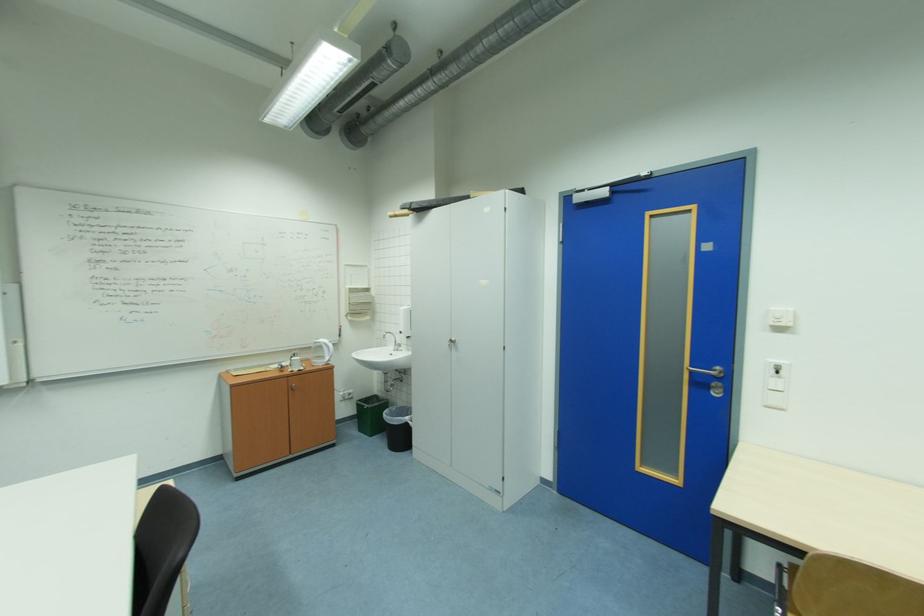
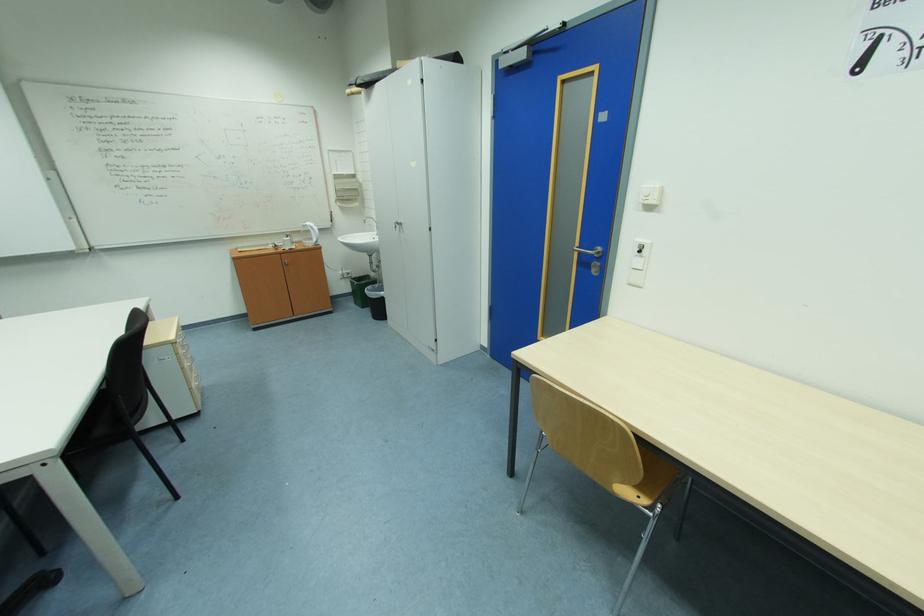
The point at (699, 373) is marked in the first image. Where is the corresponding point in the second image?

(587, 253)